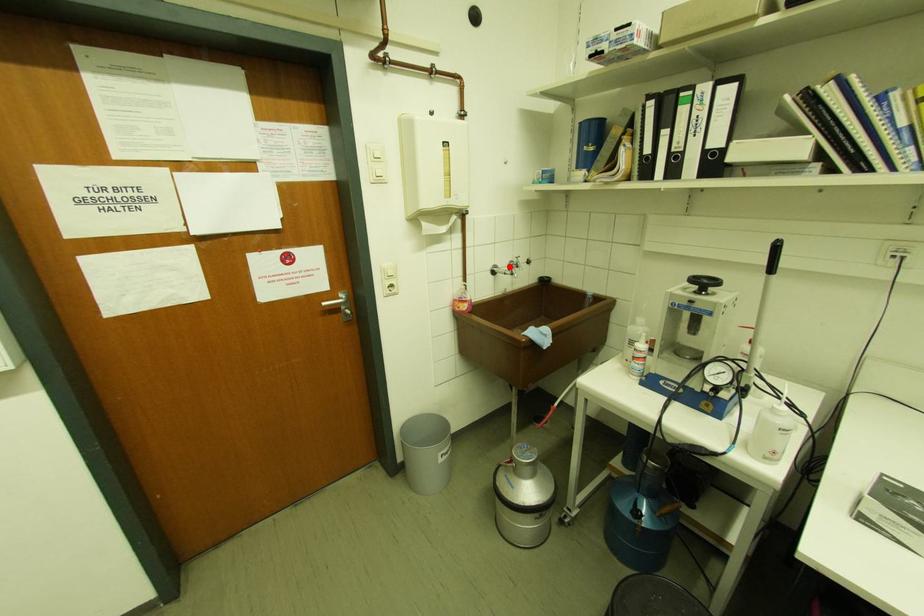
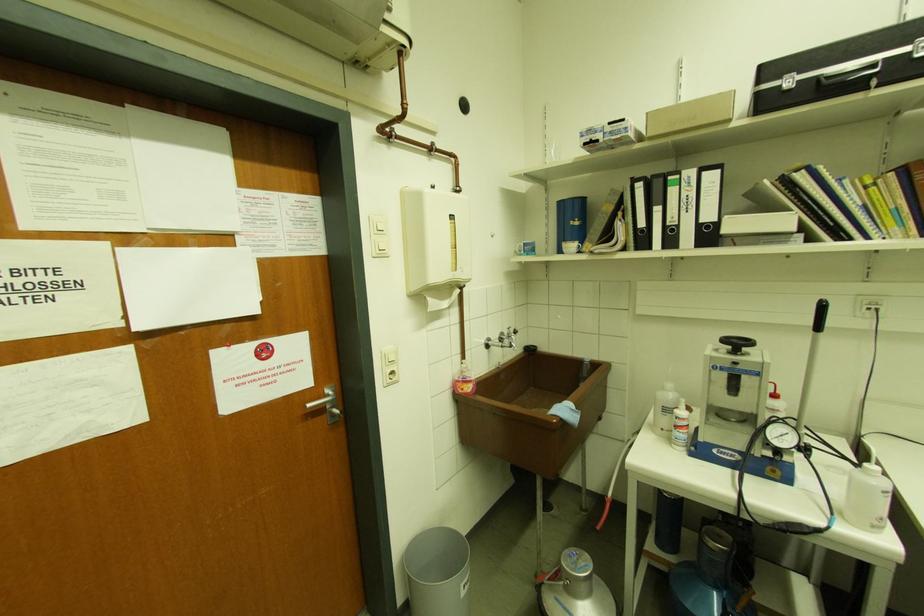
Locate, in the second image, the point that corresponds to the highlighted location in the first image.

(501, 339)